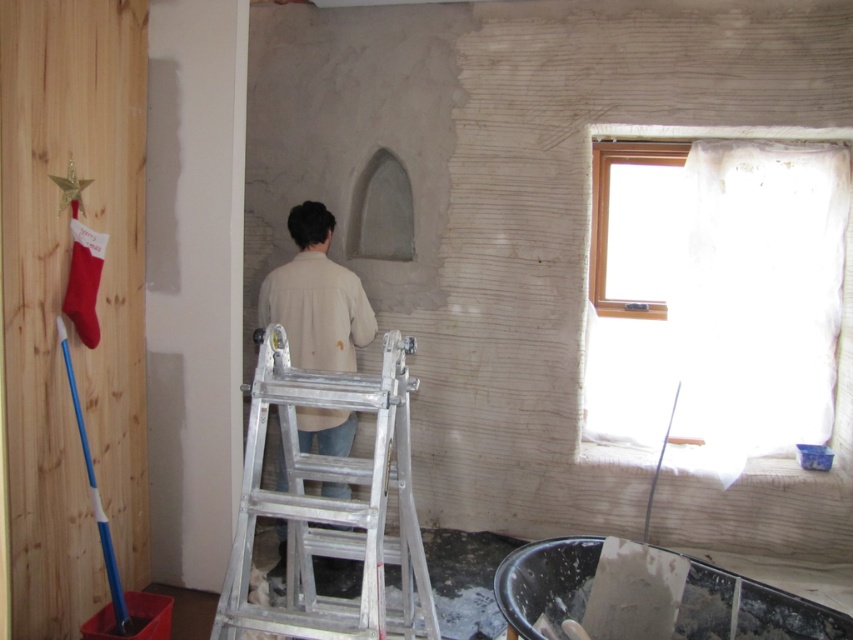
Is light beige shirt at center thinner than transparent plastic window at upper right?

Indeed, light beige shirt at center has a lesser width compared to transparent plastic window at upper right.

Is point (325, 225) more distant than point (664, 124)?

That is False.

This screenshot has width=853, height=640. Identify the location of light beige shirt at center. (316, 298).

Can you confirm if aluminum ladder at center is positioned to the right of transparent plastic window at upper right?

No, aluminum ladder at center is not to the right of transparent plastic window at upper right.

Does point (321, 531) come behind point (701, 136)?

No, it is in front of (701, 136).

The width and height of the screenshot is (853, 640). Find the location of `aluminum ladder at center`. aluminum ladder at center is located at coordinates (329, 506).

Is aluminum ladder at center taller than light beige shirt at center?

In fact, aluminum ladder at center may be shorter than light beige shirt at center.

Which is behind, point (347, 628) or point (283, 524)?

The point (283, 524) is more distant.

Between point (405, 534) and point (263, 321), which one is positioned behind?

The point (263, 321) is behind.

Identify the location of aluminum ladder at center. (329, 506).